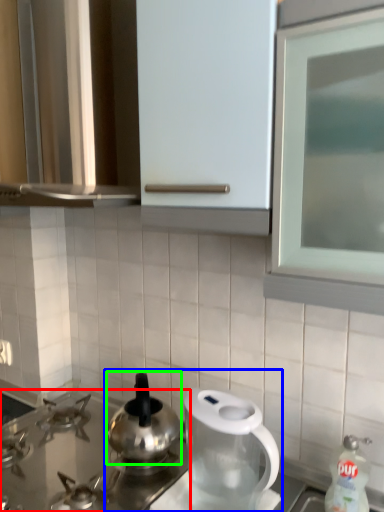
Question: Which object is positioned farthest from gas stove (highlighted by a red box)? Select from tea set (highlighted by a blue box) and kitchen appliance (highlighted by a green box).

Choices:
 (A) tea set
 (B) kitchen appliance

Answer: (A)